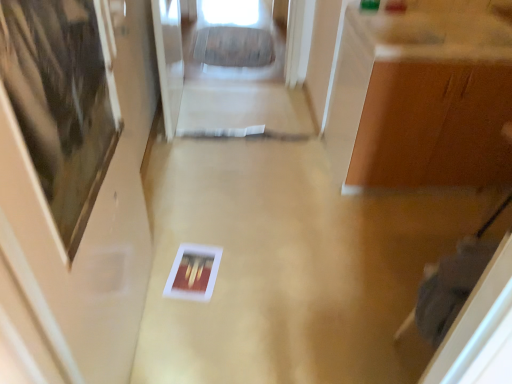
Find the location of a particular element. The width and height of the screenshot is (512, 384). vacant space underneath matte wood door at left (from a real-world perspective) is located at coordinates (150, 336).